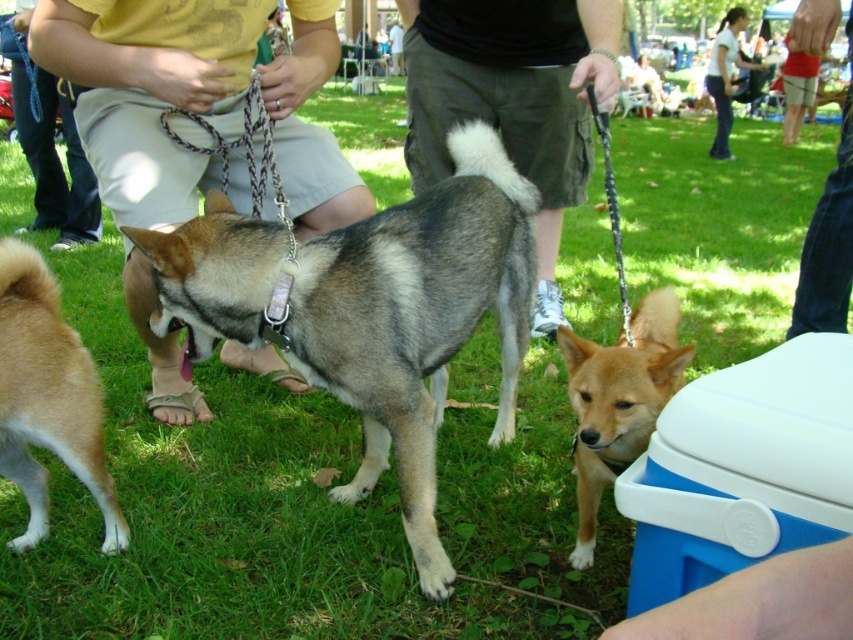
Does brown matte dog at lower right have a larger size compared to jeans at lower right?

Yes.

Is brown matte dog at lower right further to camera compared to jeans at lower right?

That is False.

This screenshot has width=853, height=640. Identify the location of brown matte dog at lower right. (619, 401).

Which is more to the left, gray-furred dog at center or yellow t-shirt at center?

yellow t-shirt at center is more to the left.

Does gray-furred dog at center appear over yellow t-shirt at center?

Actually, gray-furred dog at center is below yellow t-shirt at center.

Is point (412, 467) behind point (231, 42)?

That is False.

This screenshot has height=640, width=853. Identify the location of gray-furred dog at center. (416, 321).

From the picture: Does dark gray shorts at center have a lesser height compared to jeans at lower right?

No, dark gray shorts at center is not shorter than jeans at lower right.

Looking at this image, is dark gray shorts at center closer to the viewer compared to jeans at lower right?

Yes, it is.

Is point (567, 72) positioned before point (834, 237)?

Yes, it is in front of point (834, 237).

At what (x,y) coordinates should I click in order to perform the action: click on dark gray shorts at center. Please return your answer as a coordinate pair (x, y). Looking at the image, I should click on (514, 99).